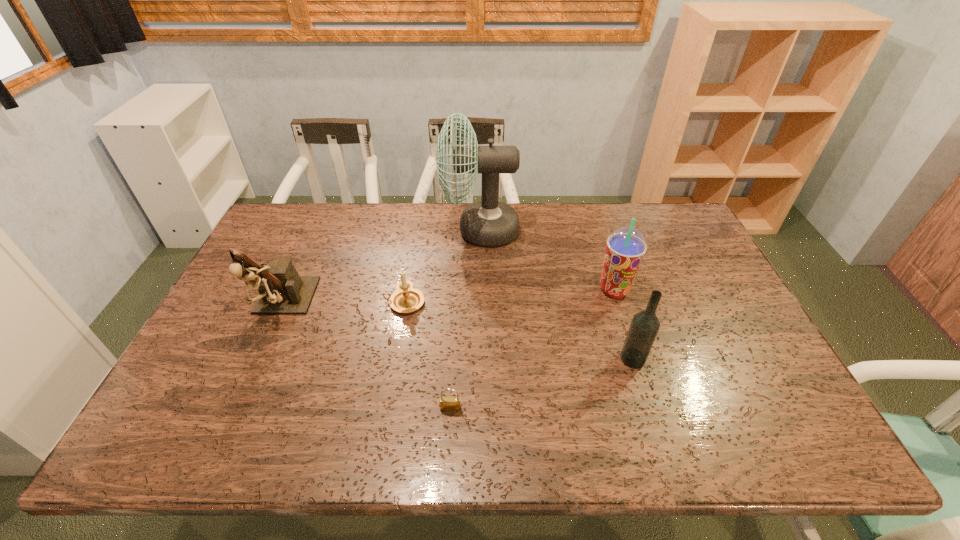
Find the location of `free space between the fan and the vodka`. free space between the fan and the vodka is located at coordinates (557, 294).

Identify the location of empty location between the smoothie and the nearest object. The width and height of the screenshot is (960, 540). (533, 349).

I want to click on free spot between the farthest object and the smoothie, so click(547, 260).

This screenshot has height=540, width=960. I want to click on free space that is in between the tallest object and the vodka, so click(x=557, y=294).

Where is `free spot between the vodka and the padlock`? free spot between the vodka and the padlock is located at coordinates (541, 383).

This screenshot has height=540, width=960. What are the coordinates of `free point between the smoothie and the leftmost object` in the screenshot? It's located at (448, 299).

You are a GUI agent. You are given a task and a screenshot of the screen. Output one action in this format:
    pyautogui.click(x=<x>, y=<y>)
    Task: Click on the third closest object to the nearest object
    The image size is (960, 540).
    Given the screenshot: What is the action you would take?
    pyautogui.click(x=281, y=290)

Locate which object ranks in proximity to the smoothie. Please provide its 2D coordinates. Your answer should be formatted as a tuple, i.e. [(x, y)], where the tuple contains the x and y coordinates of a point satisfying the conditions above.

[(645, 325)]

The height and width of the screenshot is (540, 960). I want to click on vacant space that satisfies the following two spatial constraints: 1. in front of the fan where the airflow is directed; 2. on the front-facing side of the figurine, so pos(480,307).

I want to click on blank space that satisfies the following two spatial constraints: 1. in front of the farthest object where the airflow is directed; 2. on the right side of the second nearest object, so click(x=480, y=359).